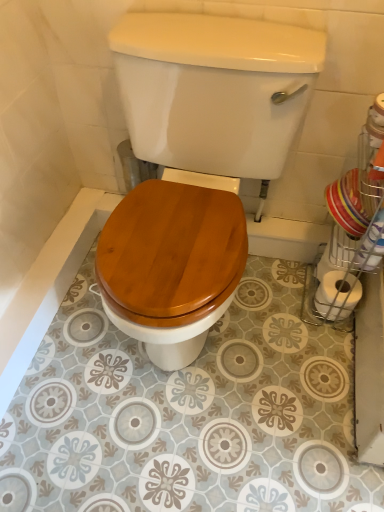
Find the location of `wooden toilet seat at center`. wooden toilet seat at center is located at coordinates (196, 165).

Describe the element at coordinates (196, 165) in the screenshot. I see `wooden toilet seat at center` at that location.

Measure the distance between wooden toilet seat at center and camera.

The depth of wooden toilet seat at center is 35.24 inches.

What do you see at coordinates (337, 295) in the screenshot?
I see `white matte toilet paper at right` at bounding box center [337, 295].

The height and width of the screenshot is (512, 384). What are the coordinates of `white matte toilet paper at right` in the screenshot? It's located at (337, 295).

Where is `wooden toilet seat at center`? This screenshot has width=384, height=512. wooden toilet seat at center is located at coordinates (196, 165).

Which is more to the left, white matte toilet paper at right or wooden toilet seat at center?

Positioned to the left is wooden toilet seat at center.

Which object is further away from the camera taking this photo, white matte toilet paper at right or wooden toilet seat at center?

white matte toilet paper at right is further from the camera.

Which is in front, point (352, 279) or point (135, 27)?

The point (135, 27) is closer.

Looking at this image, from the image's perspective, relative to wooden toilet seat at center, is white matte toilet paper at right above or below?

From the image's perspective, white matte toilet paper at right appears below wooden toilet seat at center.

From a real-world perspective, who is located lower, white matte toilet paper at right or wooden toilet seat at center?

white matte toilet paper at right.

Does white matte toilet paper at right have a greater width compared to wooden toilet seat at center?

No, white matte toilet paper at right is not wider than wooden toilet seat at center.

Is white matte toilet paper at right taller than wooden toilet seat at center?

Incorrect, the height of white matte toilet paper at right is not larger of that of wooden toilet seat at center.

Does white matte toilet paper at right have a smaller size compared to wooden toilet seat at center?

Correct, white matte toilet paper at right occupies less space than wooden toilet seat at center.

Would you say white matte toilet paper at right is outside wooden toilet seat at center?

That's correct, white matte toilet paper at right is outside of wooden toilet seat at center.

In the scene shown: Are white matte toilet paper at right and wooden toilet seat at center far apart?

Actually, white matte toilet paper at right and wooden toilet seat at center are a little close together.

Is white matte toilet paper at right oriented towards wooden toilet seat at center?

Yes, white matte toilet paper at right is oriented towards wooden toilet seat at center.

Identify the location of toilet that is in front of the white matte toilet paper at right. The height and width of the screenshot is (512, 384). (196, 165).

Can you confirm if wooden toilet seat at center is positioned to the right of white matte toilet paper at right?

No.

Is wooden toilet seat at center in front of white matte toilet paper at right?

Yes, it is in front of white matte toilet paper at right.

Does point (228, 73) come farther from viewer compared to point (347, 297)?

No, it is not.

From the image's perspective, is wooden toilet seat at center located above or below white matte toilet paper at right?

wooden toilet seat at center is situated higher than white matte toilet paper at right in the image.

From a real-world perspective, is wooden toilet seat at center on top of white matte toilet paper at right?

Correct, in the physical world, wooden toilet seat at center is higher than white matte toilet paper at right.

Does wooden toilet seat at center have a lesser width compared to white matte toilet paper at right?

Incorrect, the width of wooden toilet seat at center is not less than that of white matte toilet paper at right.

Considering the sizes of objects wooden toilet seat at center and white matte toilet paper at right in the image provided, who is taller, wooden toilet seat at center or white matte toilet paper at right?

With more height is wooden toilet seat at center.

Between wooden toilet seat at center and white matte toilet paper at right, which one has smaller size?

With smaller size is white matte toilet paper at right.

Do you think wooden toilet seat at center is within white matte toilet paper at right, or outside of it?

wooden toilet seat at center cannot be found inside white matte toilet paper at right.

Is there a large distance between wooden toilet seat at center and white matte toilet paper at right?

They are positioned close to each other.

Is wooden toilet seat at center positioned with its back to white matte toilet paper at right?

wooden toilet seat at center is not turned away from white matte toilet paper at right.

What's the angular difference between wooden toilet seat at center and white matte toilet paper at right's facing directions?

There is a 92.9-degree angle between the facing directions of wooden toilet seat at center and white matte toilet paper at right.

Find the location of a particular element. The height and width of the screenshot is (512, 384). toilet paper on the right of the wooden toilet seat at center is located at coordinates (337, 295).

The width and height of the screenshot is (384, 512). Find the location of `toilet that is above the white matte toilet paper at right (from the image's perspective)`. toilet that is above the white matte toilet paper at right (from the image's perspective) is located at coordinates (196, 165).

The width and height of the screenshot is (384, 512). Identify the location of toilet paper on the right of wooden toilet seat at center. (337, 295).